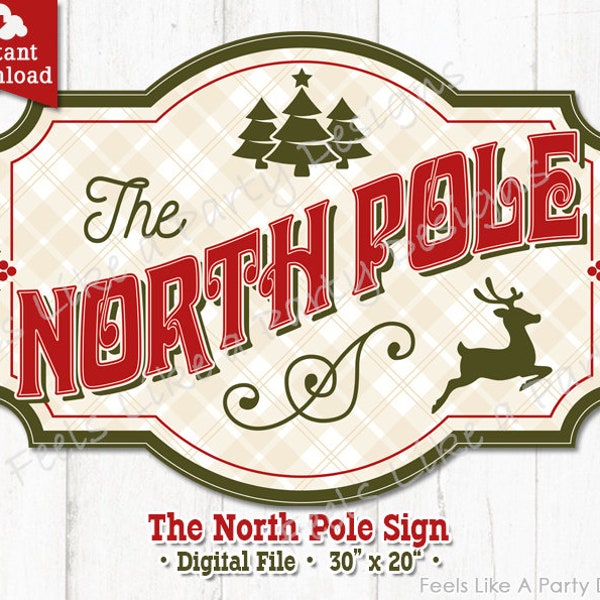
Image resolution: width=600 pixels, height=600 pixels. What are the coordinates of `star ornament` in the screenshot? It's located at (303, 75).